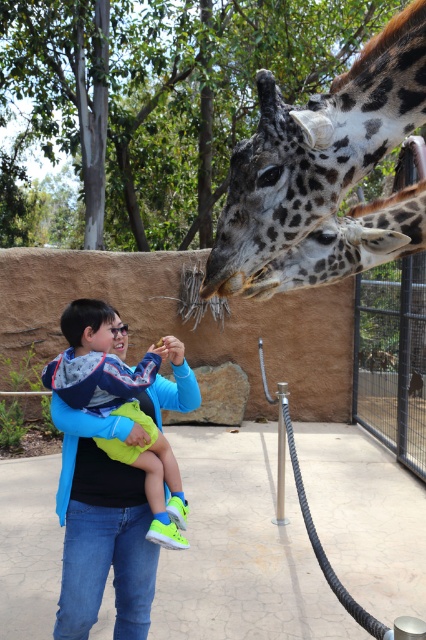
Question: Which point is closer to the camera taking this photo?

Choices:
 (A) (80, 314)
 (B) (299, 188)
 (C) (348, 257)

Answer: (B)

Question: Which of the following is the closest to the observer?

Choices:
 (A) (350, 218)
 (B) (422, 33)
 (C) (143, 452)

Answer: (B)

Question: Which of the following is the closest to the observer?

Choices:
 (A) (60, 396)
 (B) (287, 180)
 (C) (379, 236)

Answer: (B)

Question: Can you confirm if spotted fur giraffe at center is positioned to the left of spotted fur at center?

Choices:
 (A) yes
 (B) no

Answer: (A)

Question: Does spotted fur giraffe at center appear under light blue denim jacket at center?

Choices:
 (A) yes
 (B) no

Answer: (B)

Question: Can you confirm if spotted fur giraffe at center is bigger than spotted fur at center?

Choices:
 (A) yes
 (B) no

Answer: (A)